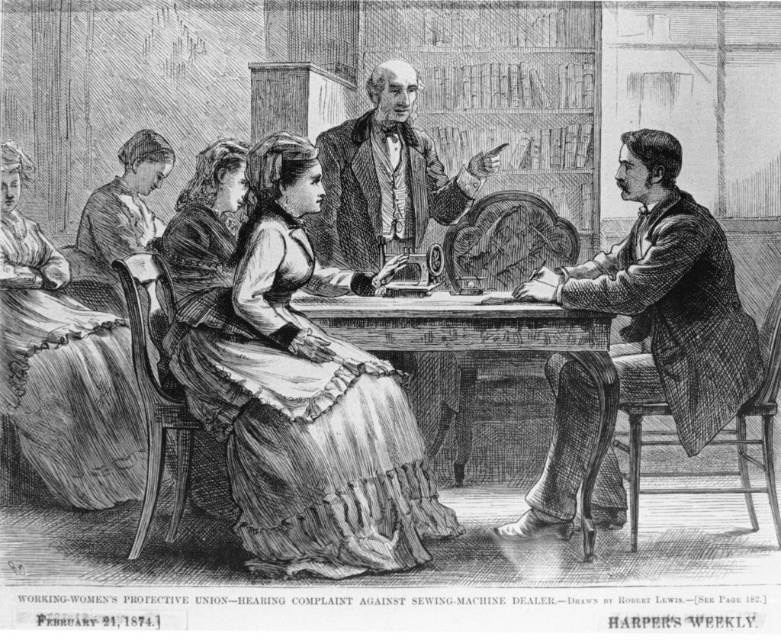
In the scene shown: You are a delivery person who needs to place a 2.5 meter long package between the smooth brown suit at right and the smooth brown coat at center. Is there enough space?

The distance between the smooth brown suit at right and the smooth brown coat at center is 2.29 meters, so the 2.5 meter long package cannot fit between them as it is longer than the available space.

You are standing in the room and want to hand a document to both the person wearing the smooth brown suit at right and the person wearing the matte white dress at left. Which person should you approach first to reach them without moving around any obstacles?

You should approach the smooth brown suit at right first because it is closer to you than the matte white dress at left, so you can reach them without needing to move around obstacles.

Based on the scene described, which object, the matte brown dress at center or the smooth brown suit at right, would be more likely to block the view of someone sitting behind it? Please explain your reasoning using the information provided.

The matte brown dress at center is much taller than the smooth brown suit at right, so it would more likely block the view of someone sitting behind it.